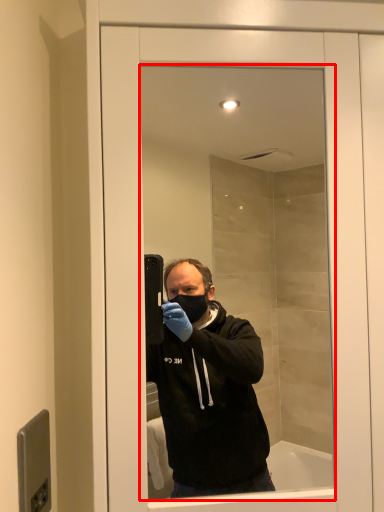
Question: Where is mirror (annotated by the red box) located in relation to door handle in the image?

Choices:
 (A) right
 (B) left

Answer: (A)